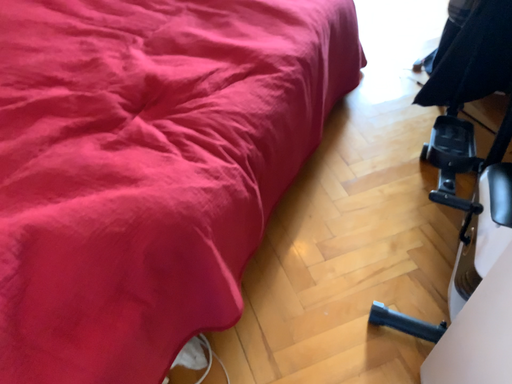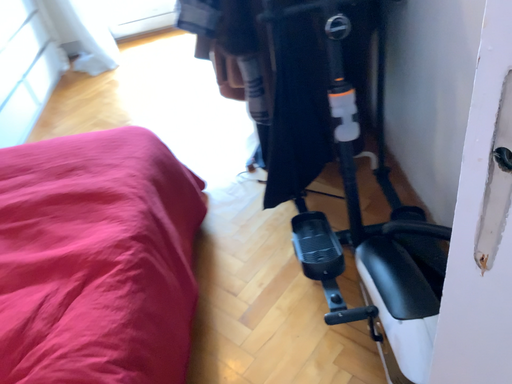
Question: How did the camera likely rotate when shooting the video?

Choices:
 (A) rotated right
 (B) rotated left

Answer: (A)